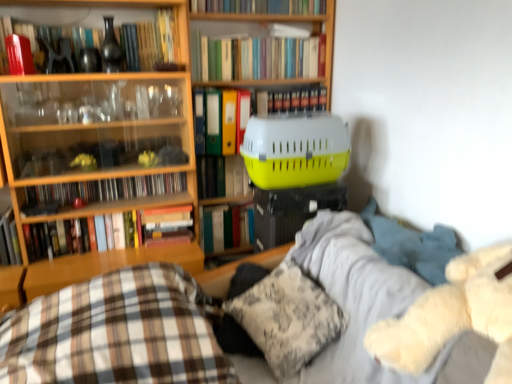
At what (x,y) coordinates should I click in order to perform the action: click on vacant point above hardcover books at upper center, placed as the third book when sorted from top to bottom (from a real-world perspective). Please return your answer as a coordinate pair (x, y). Looking at the image, I should click on (253, 33).